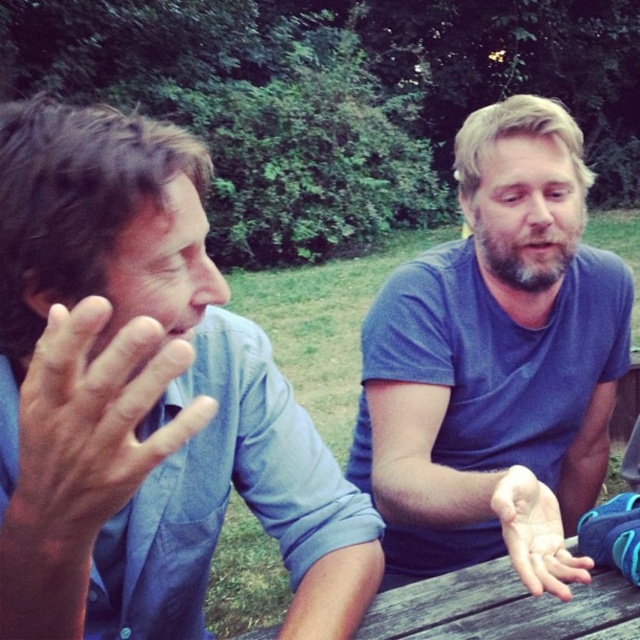
You are a photographer trying to capture a candid shot of both the blue cotton shirt at center and the matte blue shirt at left. Since you want both subjects to be in focus, which one should you focus on first to ensure the other is also sharp?

You should focus on the matte blue shirt at left first because it is farther away from the camera than the blue cotton shirt at center. By focusing on the farther subject, the closer one will also be in focus due to the depth of field.

You are a photographer wanting to capture a closeup of the smooth skin hand at center without including the matte blue shirt at left. Based on the scene, is this possible?

The matte blue shirt at left is to the left of smooth skin hand at center, so if you position the camera to frame the smooth skin hand at center while excluding the area to the left, it should be possible to capture the hand without including the shirt.

You are a photographer standing 10 feet away from the two people in the scene. You want to take a photo that includes both the blue cotton shirt at center and the matte blue shirt at left without cropping either. What is the minimum width of your camera lens in inches to capture both subjects?

The minimum width of the camera lens should be at least 20.47 inches to ensure both the blue cotton shirt at center and the matte blue shirt at left are fully captured without cropping.